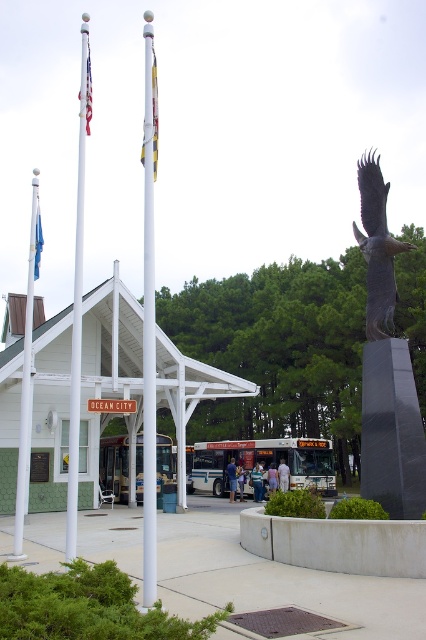
Question: Which point appears closest to the camera in this image?

Choices:
 (A) (88, 84)
 (B) (391, 252)
 (C) (39, 212)

Answer: (A)

Question: Where is black granite monument at center right located in relation to blue fabric flag at left in the image?

Choices:
 (A) above
 (B) below

Answer: (B)

Question: Does metallic silver flagpole at center appear on the left side of matte white flag at left?

Choices:
 (A) yes
 (B) no

Answer: (B)

Question: Is white glossy flag pole at center closer to the viewer compared to metallic silver flagpole at center?

Choices:
 (A) yes
 (B) no

Answer: (A)

Question: Which is nearer to the white flagpole at left?

Choices:
 (A) blue fabric flag at left
 (B) matte white flag at left
 (C) black granite monument at center right
 (D) white glossy flag pole at center

Answer: (A)

Question: Estimate the real-world distances between objects in this image. Which object is farther from the shiny bronze eagle at center right?

Choices:
 (A) metallic silver flagpole at center
 (B) blue fabric flag at left
 (C) white flagpole at left
 (D) matte white flag at left

Answer: (D)